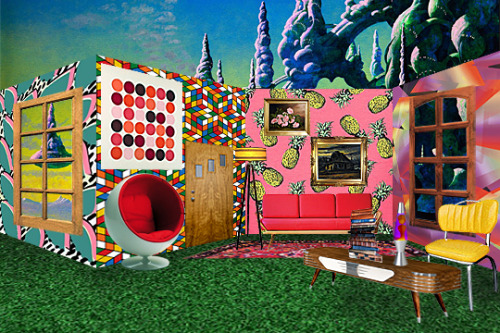
You are a GUI agent. You are given a task and a screenshot of the screen. Output one action in this format:
    pyautogui.click(x=<x>, y=<y>)
    Task: Click on the window
    
    Given the screenshot: What is the action you would take?
    pyautogui.click(x=476, y=138), pyautogui.click(x=41, y=168)